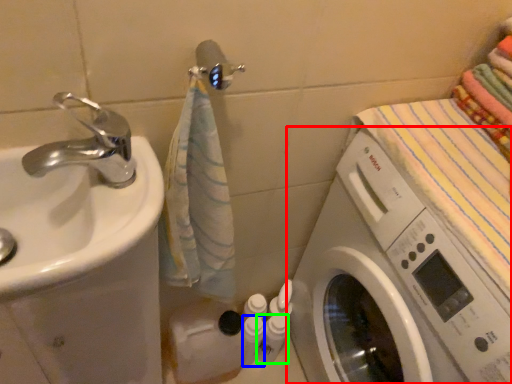
Question: Which object is the farthest from washing machine (highlighted by a red box)? Choose among these: toiletry (highlighted by a blue box) or toiletry (highlighted by a green box).

Choices:
 (A) toiletry
 (B) toiletry

Answer: (A)